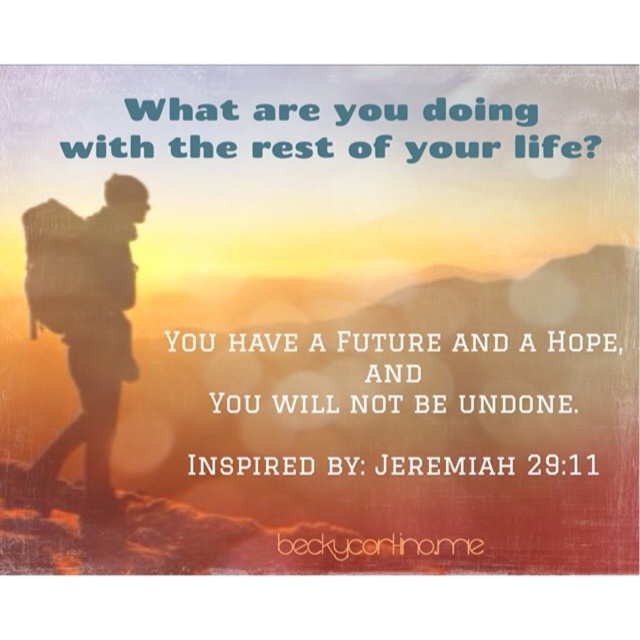
You are a hiker who wants to place a map marker at the exact location of the silhouette backpack at left. According to the coordinates provided, where should you place the marker?

The silhouette backpack at left should be marked at the coordinates point (86,323).

You are a photographer trying to capture the sunset scene. You notice the silhouette backpack at left and the white paper text at center in your frame. Which object should you focus on first to ensure it appears sharp in your photo?

You should focus on the silhouette backpack at left first because it is closer to the viewer than the white paper text at center, making it more likely to be in focus if you prioritize its sharpness.